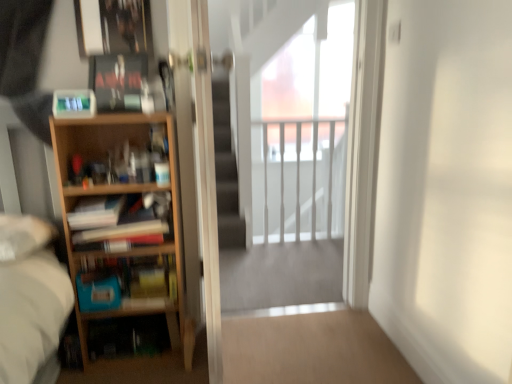
Question: Considering the positions of light wood bookcase at left and transparent glass screen door at center, the 1th screen door when ordered from left to right, in the image, is light wood bookcase at left wider or thinner than transparent glass screen door at center, the 1th screen door when ordered from left to right,?

Choices:
 (A) thin
 (B) wide

Answer: (A)

Question: Considering the positions of point (150, 188) and point (184, 29), is point (150, 188) closer or farther from the camera than point (184, 29)?

Choices:
 (A) farther
 (B) closer

Answer: (A)

Question: Estimate the real-world distances between objects in this image. Which object is closer to the light wood bookcase at left?

Choices:
 (A) white glossy railing at upper center
 (B) wooden bookshelf at left, which is counted as the 3th book, starting from the top
 (C) matte black book at upper left, which is counted as the 1th book, starting from the top
 (D) metallic silver picture frame at upper left
 (E) transparent glass screen door at center, the 1th screen door when ordered from left to right

Answer: (B)

Question: Which is farther from the matte black book at upper left, the third book in the bottom-to-top sequence?

Choices:
 (A) wooden bookshelf at left, which is counted as the 3th book, starting from the top
 (B) transparent glass screen door at center, the 2th screen door positioned from the right
 (C) wooden bookshelf at left, the second book viewed from the top
 (D) transparent glass screen door at center, which is the 1th screen door in right-to-left order
 (E) metallic silver picture frame at upper left

Answer: (D)